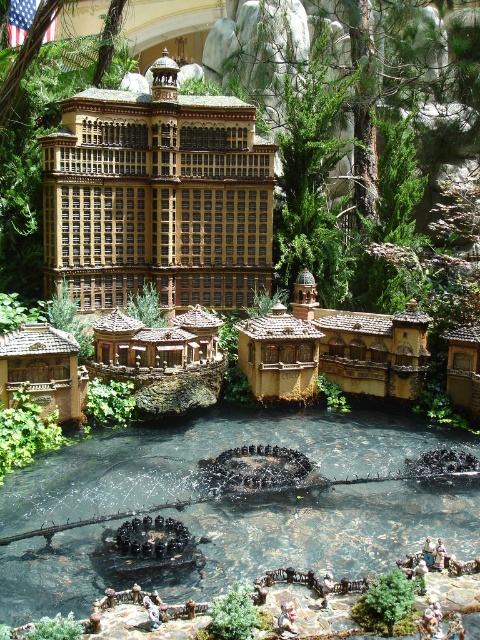
What are the coordinates of the wooden hut at center?

The wooden hut at center is located at coordinates point (x=44, y=369).

You are standing at the base of the grand building and want to visit both the brown wooden hut at center and the wooden hut at lower right. Which one should you visit first if you want to follow the path that goes from lower to higher elevation?

You should visit the wooden hut at lower right first because it is located below the brown wooden hut at center, so following a path from lower to higher elevation would mean starting at the lower one and moving upwards to the higher one.